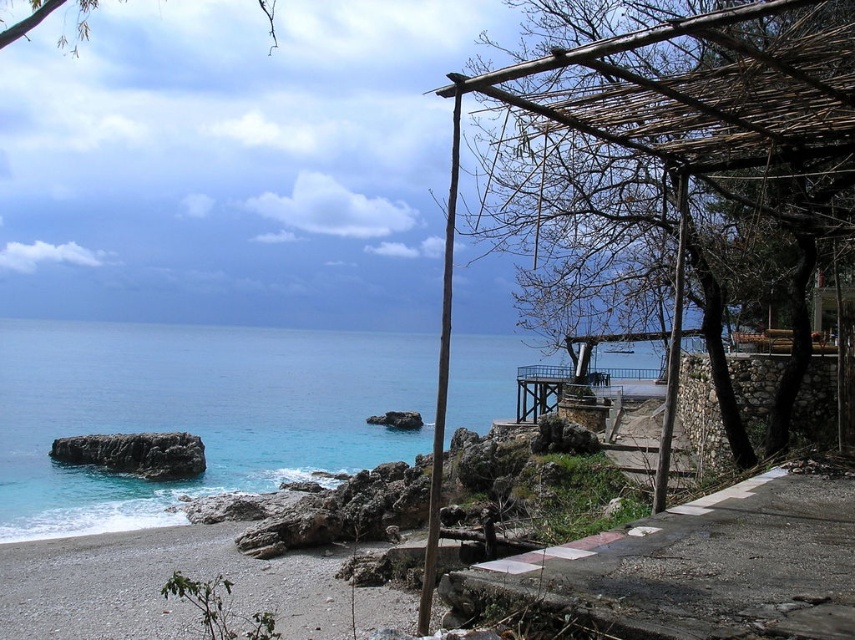
Question: Considering the real-world distances, which object is farthest from the gray gravel beach at lower left?

Choices:
 (A) dark gray rock at lower left
 (B) blue water at lower left

Answer: (B)

Question: Is blue water at lower left to the right of dark gray rock at lower left from the viewer's perspective?

Choices:
 (A) no
 (B) yes

Answer: (A)

Question: Is gray gravel beach at lower left positioned behind dark gray rock at lower left?

Choices:
 (A) no
 (B) yes

Answer: (A)

Question: Among these objects, which one is nearest to the camera?

Choices:
 (A) gray gravel beach at lower left
 (B) blue water at lower left

Answer: (A)

Question: Considering the real-world distances, which object is closest to the gray gravel beach at lower left?

Choices:
 (A) dark gray rock at lower left
 (B) blue water at lower left

Answer: (A)

Question: Is blue water at lower left above dark gray rock at lower left?

Choices:
 (A) yes
 (B) no

Answer: (A)